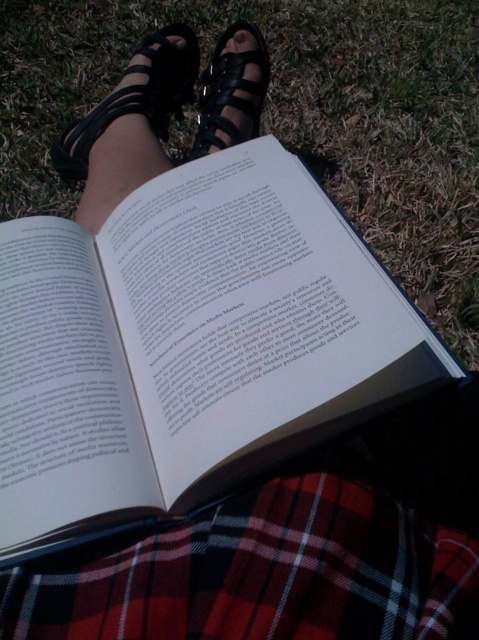
You are a photographer trying to capture the person reading their book. If you want to focus on the white paper book at center without the black leather sandal at center blocking the view, should you move the camera slightly forward or backward?

The white paper book at center is in front of the black leather sandal at center, so moving the camera slightly backward would help focus on the book without the sandal blocking the view.

You are a photographer trying to capture the scene of a person reading. You notice the white paper book at center and the black leather sandal at center. Which object should you focus on first if you want to capture the subject reading the book while also including the sandal in the frame?

The white paper book at center is to the left of the black leather sandal at center. To capture the subject reading the book while including the sandal, focus on the white paper book at center first as it is positioned to the left, allowing the sandal to be included in the frame from the right side.

You are a photographer trying to capture the scene of a person reading outdoors. You notice two points in the image at coordinates point (x=172, y=12) and point (x=193, y=154). If you want to focus on the point closer to you, which coordinate should you choose?

Point (x=172, y=12) is further to the viewer than point (x=193, y=154), so you should choose point (x=172, y=12) to focus on the closer point.